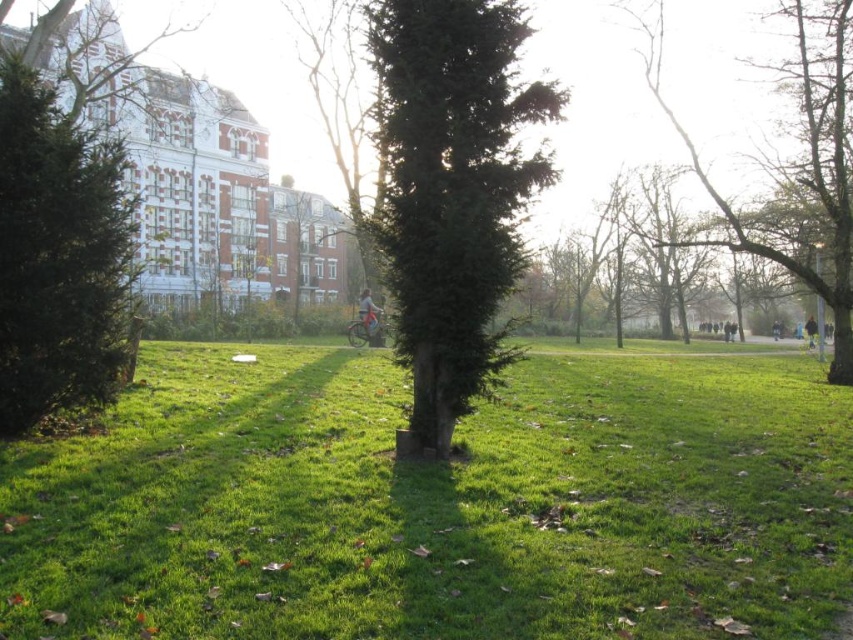
You are standing in the park and see the green grassy at center and the light blue fabric jacket at center. Which object is taller?

The light blue fabric jacket at center is taller than the green grassy at center.

You are standing in the park and see the green grassy at center and the light blue fabric jacket at center. Which object is closer to the ground?

The green grassy at center is positioned under the light blue fabric jacket at center, so the green grassy at center is closer to the ground.

You are standing at the center of the park and see the light blue fabric jacket at center. If you walk directly towards the jacket, will you encounter any obstacles?

The light blue fabric jacket at center is located at point (368, 314), so walking directly towards it would not encounter any obstacles since the foreground is a grassy area with scattered leaves and the midground has a person on a bicycle moving away from the camera towards the background. The path is bordered by trees but the jacket is at the center, so the path is clear.